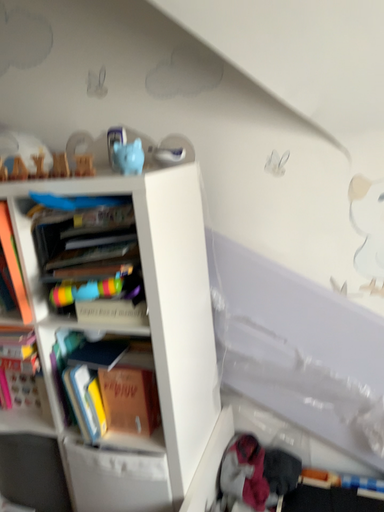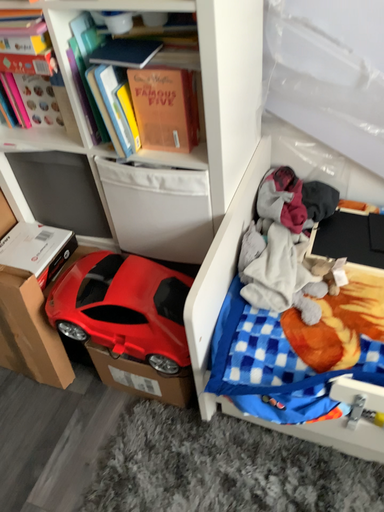
Question: Which way did the camera rotate in the video?

Choices:
 (A) rotated upward
 (B) rotated downward

Answer: (B)